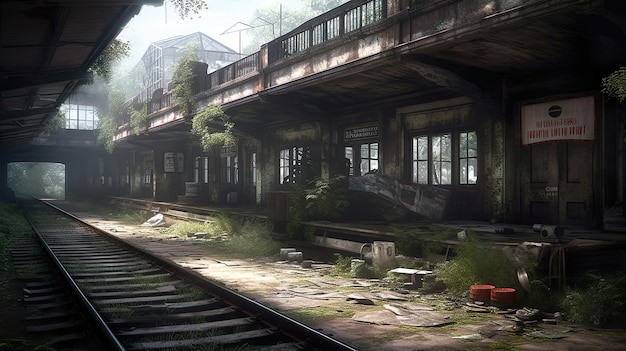
Locate an element on the screen. The height and width of the screenshot is (351, 626). windows is located at coordinates (466, 170), (424, 167), (366, 152).